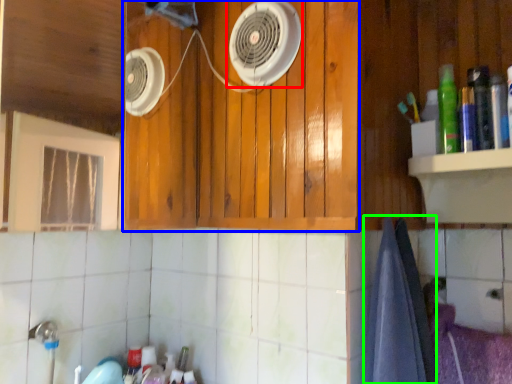
Question: Based on their relative distances, which object is farther from home appliance (highlighted by a red box)? Choose from cabinetry (highlighted by a blue box) and bath towel (highlighted by a green box).

Choices:
 (A) cabinetry
 (B) bath towel

Answer: (B)